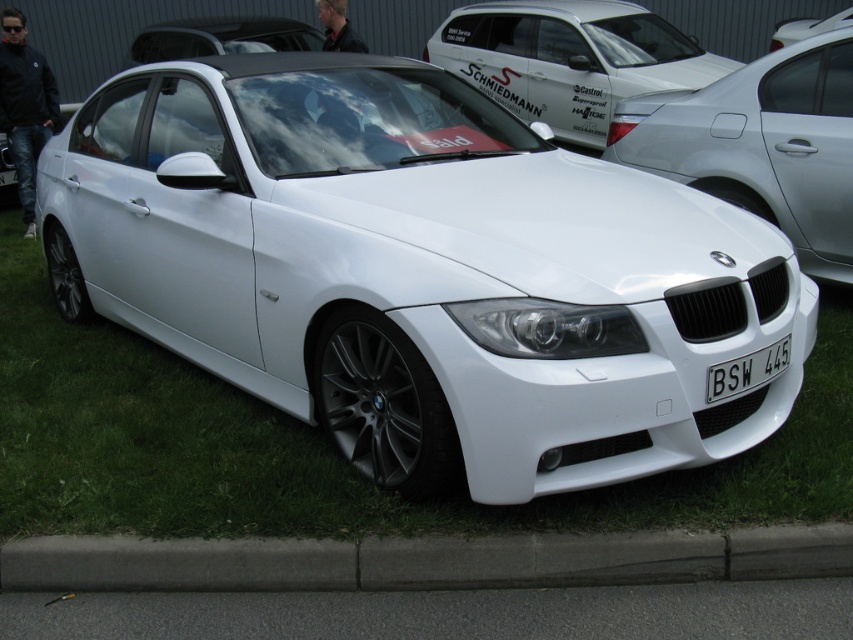
Find the location of a particular element. white glossy sedan at center is located at coordinates (761, 145).

Does white glossy sedan at center appear over white plastic license plate at center?

Yes, white glossy sedan at center is above white plastic license plate at center.

Who is more distant from viewer, [821,182] or [746,376]?

Positioned behind is point [821,182].

The height and width of the screenshot is (640, 853). In order to click on white glossy sedan at center in this screenshot , I will do `click(761, 145)`.

Can you confirm if white glossy car at center is positioned to the left of white plastic license plate at center?

→ Indeed, white glossy car at center is positioned on the left side of white plastic license plate at center.

At what (x,y) coordinates should I click in order to perform the action: click on white glossy car at center. Please return your answer as a coordinate pair (x, y). Image resolution: width=853 pixels, height=640 pixels. Looking at the image, I should click on (24, 106).

Does white glossy sedan at center appear over white matte car at upper center?

No, white glossy sedan at center is not above white matte car at upper center.

Does white glossy sedan at center have a smaller size compared to white matte car at upper center?

No, white glossy sedan at center is not smaller than white matte car at upper center.

Does point (838, 172) come in front of point (808, 32)?

Yes, it is.

The height and width of the screenshot is (640, 853). Find the location of `white glossy sedan at center`. white glossy sedan at center is located at coordinates (761, 145).